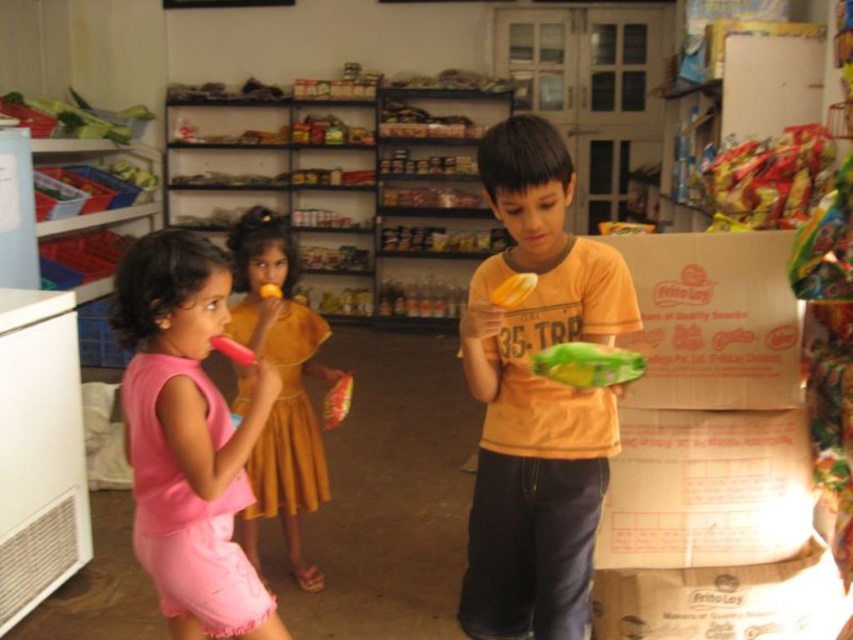
Question: Among these points, which one is farthest from the camera?

Choices:
 (A) (595, 352)
 (B) (349, 378)
 (C) (305, 472)

Answer: (C)

Question: Among these objects, which one is farthest from the camera?

Choices:
 (A) pink fabric dress at center
 (B) green matte toy at center
 (C) pink plastic toy at center

Answer: (A)

Question: Is orange cotton shirt at center above pink fabric dress at left?

Choices:
 (A) no
 (B) yes

Answer: (B)

Question: From the image, what is the correct spatial relationship of green matte toy at center in relation to yellow plastic toy at center?

Choices:
 (A) left
 (B) right

Answer: (B)

Question: Among these points, which one is nearest to the camera?

Choices:
 (A) (544, 520)
 (B) (254, 372)
 (C) (296, 316)

Answer: (B)

Question: Can you confirm if pink fabric dress at left is positioned above green matte toy at center?

Choices:
 (A) no
 (B) yes

Answer: (A)